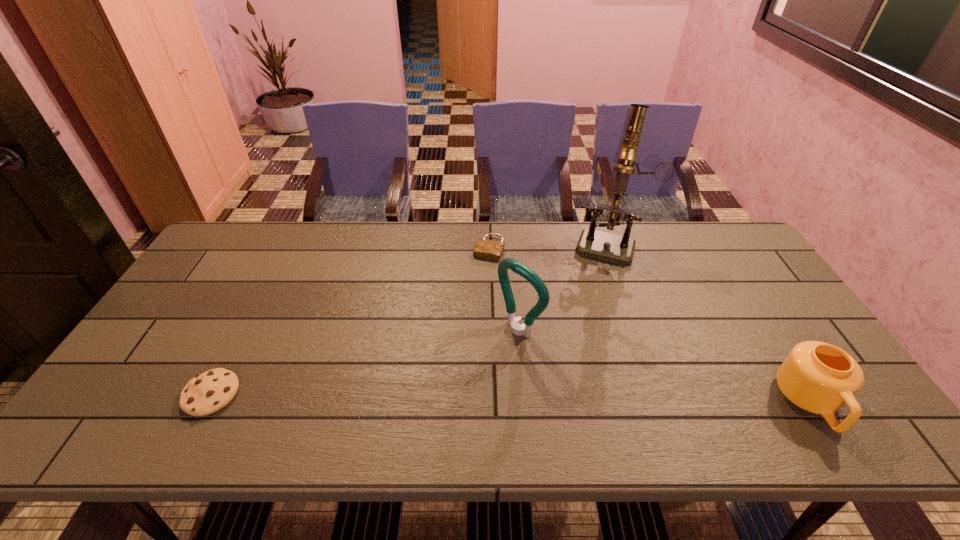
Image resolution: width=960 pixels, height=540 pixels. I want to click on vacant space on the desktop that is between the cookie and the rightmost object and is positioned at the jaws of the fourth shortest object, so click(x=435, y=397).

Where is `free spot on the desktop that is between the leftmost object and the rightmost object and is positioned on the keyhole side of the padlock`? free spot on the desktop that is between the leftmost object and the rightmost object and is positioned on the keyhole side of the padlock is located at coordinates (426, 397).

The image size is (960, 540). I want to click on vacant space on the desktop that is between the cookie and the rightmost object and is positioned at the eyepiece of the second object from right to left, so click(565, 400).